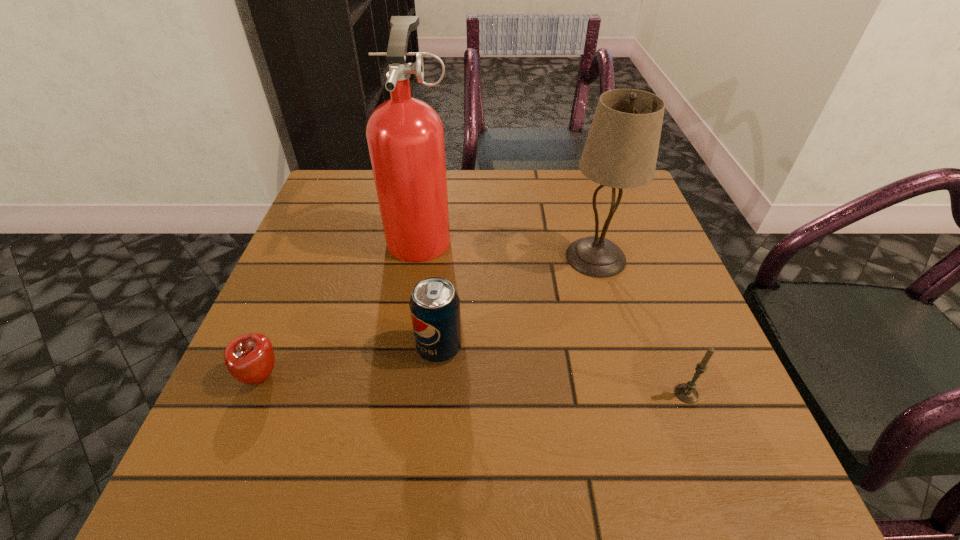
Locate an element on the screen. Image resolution: width=960 pixels, height=540 pixels. fire extinguisher is located at coordinates (405, 136).

Find the location of a particular element. The width and height of the screenshot is (960, 540). lampshade is located at coordinates (621, 150).

Locate an element on the screen. The width and height of the screenshot is (960, 540). soda can is located at coordinates (434, 304).

Where is `the second shortest object`? This screenshot has height=540, width=960. the second shortest object is located at coordinates (686, 392).

What are the coordinates of `apple` in the screenshot? It's located at 249,358.

Identify the location of the leftmost object. This screenshot has height=540, width=960. (249, 358).

In order to click on vacant area situated on the back of the fire extinguisher in this screenshot , I will do `click(427, 192)`.

Locate an element on the screen. The width and height of the screenshot is (960, 540). free spot located 0.150m on the front-facing side of the lampshade is located at coordinates (497, 257).

The image size is (960, 540). I want to click on vacant space positioned 0.260m on the front-facing side of the lampshade, so click(x=447, y=257).

You are a GUI agent. You are given a task and a screenshot of the screen. Output one action in this format:
    pyautogui.click(x=<x>, y=<y>)
    Task: Click on the vacant space located on the front-facing side of the lampshade
    Image resolution: width=960 pixels, height=540 pixels.
    Given the screenshot: What is the action you would take?
    pyautogui.click(x=501, y=257)